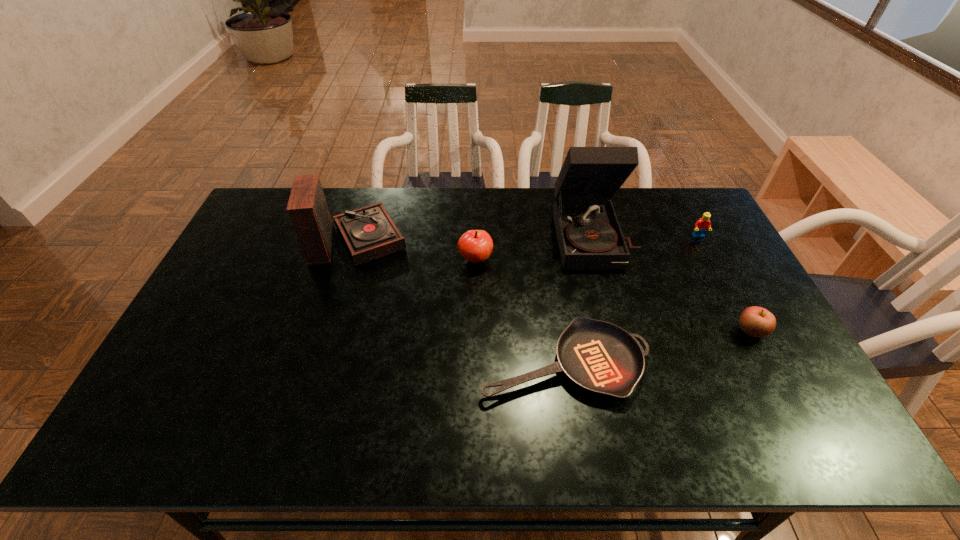
What are the coordinates of `free space that is in between the Lego and the taller phonograph record` in the screenshot? It's located at (646, 236).

Find the location of a particular element. This screenshot has height=540, width=960. unoccupied area between the frying pan and the tallest object is located at coordinates (579, 299).

Locate an element on the screen. This screenshot has height=540, width=960. object that can be found as the fourth closest to the left apple is located at coordinates (701, 226).

Identify the location of object that can be found as the closest to the Lego. (589, 235).

This screenshot has width=960, height=540. In order to click on vacant space that satisfies the following two spatial constraints: 1. on the front-facing side of the shorter apple; 2. on the left side of the tallest object in this screenshot , I will do `click(619, 330)`.